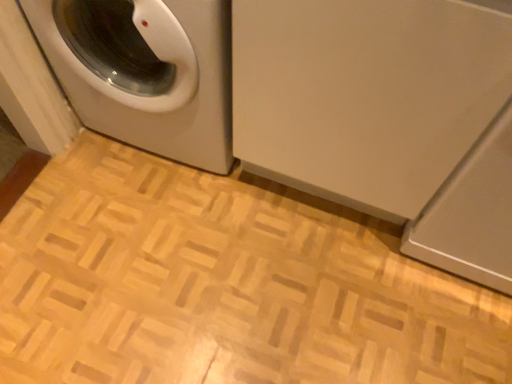
In order to click on white glossy washing machine at left, which is counted as the 1th washing machine, starting from the left in this screenshot , I will do `click(145, 72)`.

What do you see at coordinates (145, 72) in the screenshot? I see `white glossy washing machine at left, which is counted as the 1th washing machine, starting from the left` at bounding box center [145, 72].

Locate an element on the screen. white glossy washing machine at upper left, marked as the first washing machine in a right-to-left arrangement is located at coordinates (387, 117).

In order to face white glossy washing machine at upper left, marked as the first washing machine in a right-to-left arrangement, should I rotate leftwards or rightwards?

You should rotate right by 6.298 degrees.

From the picture: Measure the distance between point (271, 70) and camera.

They are 3.40 feet apart.

What do you see at coordinates (387, 117) in the screenshot? The image size is (512, 384). I see `white glossy washing machine at upper left, the second washing machine when ordered from left to right` at bounding box center [387, 117].

Find the location of `white glossy washing machine at left, the 2th washing machine when ordered from right to left`. white glossy washing machine at left, the 2th washing machine when ordered from right to left is located at coordinates (145, 72).

Considering the positions of objects white glossy washing machine at upper left, marked as the first washing machine in a right-to-left arrangement, and white glossy washing machine at left, the 2th washing machine when ordered from right to left, in the image provided, who is more to the right, white glossy washing machine at upper left, marked as the first washing machine in a right-to-left arrangement, or white glossy washing machine at left, the 2th washing machine when ordered from right to left,?

white glossy washing machine at upper left, marked as the first washing machine in a right-to-left arrangement.

Is white glossy washing machine at upper left, marked as the first washing machine in a right-to-left arrangement, positioned in front of white glossy washing machine at left, which is counted as the 1th washing machine, starting from the left?

Yes.

Does point (381, 59) lie behind point (178, 149)?

No, it is not.

From the image's perspective, is white glossy washing machine at upper left, marked as the first washing machine in a right-to-left arrangement, positioned above or below white glossy washing machine at left, which is counted as the 1th washing machine, starting from the left?

white glossy washing machine at upper left, marked as the first washing machine in a right-to-left arrangement, is below white glossy washing machine at left, which is counted as the 1th washing machine, starting from the left.

From a real-world perspective, is white glossy washing machine at upper left, the second washing machine when ordered from left to right, physically below white glossy washing machine at left, which is counted as the 1th washing machine, starting from the left?

Actually, white glossy washing machine at upper left, the second washing machine when ordered from left to right, is physically above white glossy washing machine at left, which is counted as the 1th washing machine, starting from the left, in the real world.

Does white glossy washing machine at upper left, the second washing machine when ordered from left to right, have a lesser width compared to white glossy washing machine at left, the 2th washing machine when ordered from right to left?

In fact, white glossy washing machine at upper left, the second washing machine when ordered from left to right, might be wider than white glossy washing machine at left, the 2th washing machine when ordered from right to left.

Considering the relative sizes of white glossy washing machine at upper left, the second washing machine when ordered from left to right, and white glossy washing machine at left, the 2th washing machine when ordered from right to left, in the image provided, is white glossy washing machine at upper left, the second washing machine when ordered from left to right, shorter than white glossy washing machine at left, the 2th washing machine when ordered from right to left,?

No, white glossy washing machine at upper left, the second washing machine when ordered from left to right, is not shorter than white glossy washing machine at left, the 2th washing machine when ordered from right to left.

Who is bigger, white glossy washing machine at upper left, the second washing machine when ordered from left to right, or white glossy washing machine at left, the 2th washing machine when ordered from right to left?

Bigger between the two is white glossy washing machine at upper left, the second washing machine when ordered from left to right.

Is white glossy washing machine at upper left, the second washing machine when ordered from left to right, positioned beyond the bounds of white glossy washing machine at left, which is counted as the 1th washing machine, starting from the left?

Indeed, white glossy washing machine at upper left, the second washing machine when ordered from left to right, is completely outside white glossy washing machine at left, which is counted as the 1th washing machine, starting from the left.

Would you say white glossy washing machine at upper left, the second washing machine when ordered from left to right, is a long distance from white glossy washing machine at left, the 2th washing machine when ordered from right to left?

Actually, white glossy washing machine at upper left, the second washing machine when ordered from left to right, and white glossy washing machine at left, the 2th washing machine when ordered from right to left, are a little close together.

Is white glossy washing machine at upper left, the second washing machine when ordered from left to right, looking in the opposite direction of white glossy washing machine at left, which is counted as the 1th washing machine, starting from the left?

Yes.

What's the angular difference between white glossy washing machine at upper left, the second washing machine when ordered from left to right, and white glossy washing machine at left, the 2th washing machine when ordered from right to left,'s facing directions?

white glossy washing machine at upper left, the second washing machine when ordered from left to right, and white glossy washing machine at left, the 2th washing machine when ordered from right to left, are facing 0.144 degrees away from each other.

Locate an element on the screen. This screenshot has height=384, width=512. washing machine lying on the right of white glossy washing machine at left, which is counted as the 1th washing machine, starting from the left is located at coordinates point(387,117).

Can you confirm if white glossy washing machine at left, which is counted as the 1th washing machine, starting from the left, is positioned to the right of white glossy washing machine at upper left, the second washing machine when ordered from left to right?

No, white glossy washing machine at left, which is counted as the 1th washing machine, starting from the left, is not to the right of white glossy washing machine at upper left, the second washing machine when ordered from left to right.

Who is more distant, white glossy washing machine at left, which is counted as the 1th washing machine, starting from the left, or white glossy washing machine at upper left, the second washing machine when ordered from left to right?

white glossy washing machine at left, which is counted as the 1th washing machine, starting from the left, is more distant.

Which is closer, (174, 88) or (431, 48)?

Clearly, point (174, 88) is more distant from the camera than point (431, 48).

From the image's perspective, would you say white glossy washing machine at left, the 2th washing machine when ordered from right to left, is positioned over white glossy washing machine at upper left, marked as the first washing machine in a right-to-left arrangement?

Indeed, from the image's perspective, white glossy washing machine at left, the 2th washing machine when ordered from right to left, is shown above white glossy washing machine at upper left, marked as the first washing machine in a right-to-left arrangement.

From a real-world perspective, is white glossy washing machine at left, which is counted as the 1th washing machine, starting from the left, physically below white glossy washing machine at upper left, marked as the first washing machine in a right-to-left arrangement?

Yes, from a real-world perspective, white glossy washing machine at left, which is counted as the 1th washing machine, starting from the left, is below white glossy washing machine at upper left, marked as the first washing machine in a right-to-left arrangement.

Does white glossy washing machine at left, the 2th washing machine when ordered from right to left, have a greater width compared to white glossy washing machine at upper left, marked as the first washing machine in a right-to-left arrangement?

No, white glossy washing machine at left, the 2th washing machine when ordered from right to left, is not wider than white glossy washing machine at upper left, marked as the first washing machine in a right-to-left arrangement.

Between white glossy washing machine at left, the 2th washing machine when ordered from right to left, and white glossy washing machine at upper left, the second washing machine when ordered from left to right, which one has less height?

white glossy washing machine at left, the 2th washing machine when ordered from right to left.

Does white glossy washing machine at left, which is counted as the 1th washing machine, starting from the left, have a larger size compared to white glossy washing machine at upper left, marked as the first washing machine in a right-to-left arrangement?

Incorrect, white glossy washing machine at left, which is counted as the 1th washing machine, starting from the left, is not larger than white glossy washing machine at upper left, marked as the first washing machine in a right-to-left arrangement.

Is white glossy washing machine at left, which is counted as the 1th washing machine, starting from the left, positioned beyond the bounds of white glossy washing machine at upper left, marked as the first washing machine in a right-to-left arrangement?

No, white glossy washing machine at left, which is counted as the 1th washing machine, starting from the left, is not entirely external to white glossy washing machine at upper left, marked as the first washing machine in a right-to-left arrangement.

Are white glossy washing machine at left, the 2th washing machine when ordered from right to left, and white glossy washing machine at upper left, marked as the first washing machine in a right-to-left arrangement, located far from each other?

No, there isn't a large distance between white glossy washing machine at left, the 2th washing machine when ordered from right to left, and white glossy washing machine at upper left, marked as the first washing machine in a right-to-left arrangement.

Is white glossy washing machine at left, which is counted as the 1th washing machine, starting from the left, facing away from white glossy washing machine at upper left, the second washing machine when ordered from left to right?

Yes.

The height and width of the screenshot is (384, 512). What are the coordinates of `washing machine on the left of white glossy washing machine at upper left, the second washing machine when ordered from left to right` in the screenshot? It's located at (145, 72).

The image size is (512, 384). Identify the location of washing machine located on the left of white glossy washing machine at upper left, the second washing machine when ordered from left to right. (145, 72).

You are a GUI agent. You are given a task and a screenshot of the screen. Output one action in this format:
    pyautogui.click(x=<x>, y=<y>)
    Task: Click on the washing machine above the white glossy washing machine at left, which is counted as the 1th washing machine, starting from the left (from a real-world perspective)
    This screenshot has width=512, height=384.
    Given the screenshot: What is the action you would take?
    pyautogui.click(x=387, y=117)